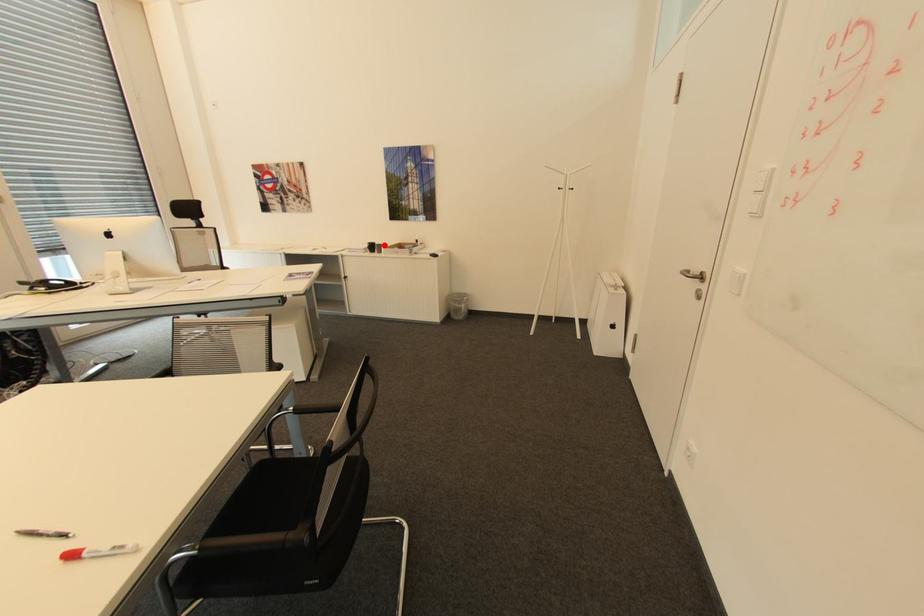
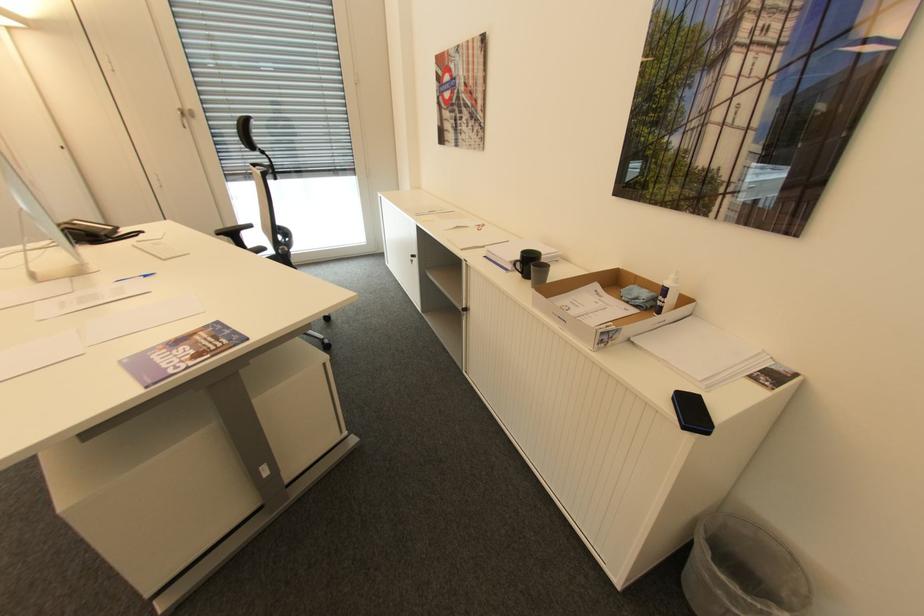
The point at the highlighted location is marked in the first image. Where is the corresponding point in the second image?

(550, 268)